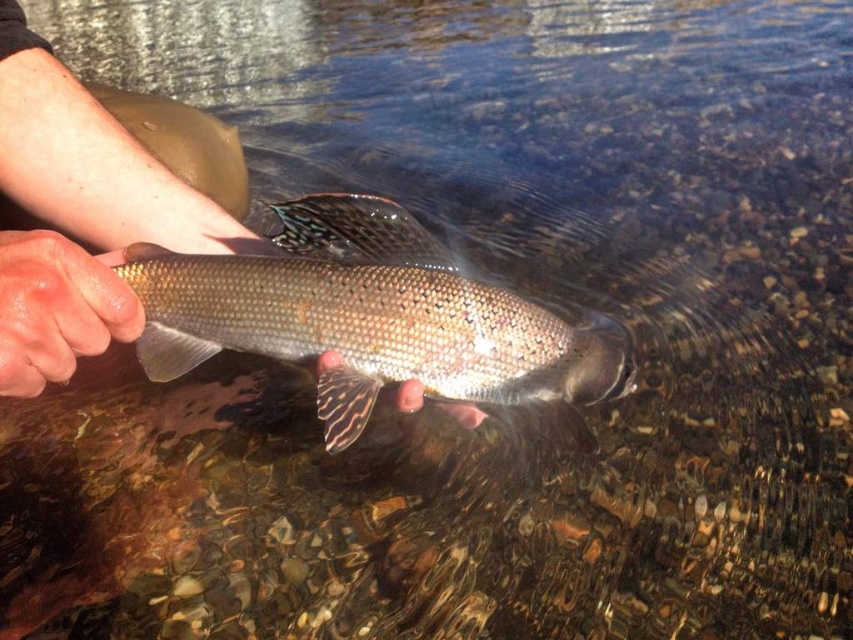
You are a dermatologist examining a patient. The patient has two areas of skin visible in the image described above. The smooth skin hand at center and dry skin at center. You need to determine if the distance between them is sufficient to avoid cross contamination during a procedure. The required minimum distance for safety is 4 inches. Can the patient proceed?

The smooth skin hand at center and dry skin at center are 4.35 inches apart, which exceeds the required minimum distance of 4 inches for safety. Therefore, the patient can proceed with the procedure.

You are a dermatologist examining a patient. You notice two areas of skin on their arm labeled as smooth skin hand at center and dry skin at center. Based on their positions, which area is more likely to be exposed to water frequently?

The smooth skin hand at center is above dry skin at center, so the smooth skin hand at center is more likely to be exposed to water frequently since it is positioned higher and might be in contact with water more often.

You are a biologist observing a trout in a stream. You notice the shiny silver fish at center and the smooth skin hand at center. Which object has a smaller width?

The shiny silver fish at center is thinner than the smooth skin hand at center, so the shiny silver fish at center has a smaller width.